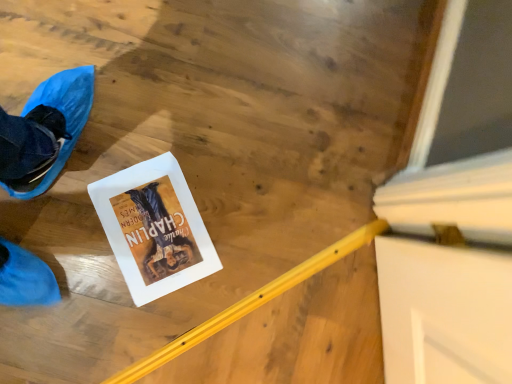
Describe the element at coordinates (154, 228) in the screenshot. Image resolution: width=512 pixels, height=384 pixels. I see `white paper book cover at center` at that location.

What is the approximate height of white paper book cover at center?

white paper book cover at center is 0.60 inches tall.

In order to face white paper book cover at center, should I rotate leftwards or rightwards?

Turn left approximately 13.365 degrees to face it.

Locate an element on the screen. Image resolution: width=512 pixels, height=384 pixels. white paper book cover at center is located at coordinates (154, 228).

The height and width of the screenshot is (384, 512). Identify the location of white paper book cover at center. (154, 228).